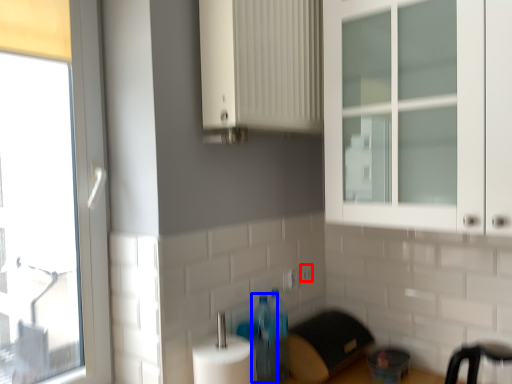
Question: Which object appears closest to the camera in this image, electric outlet (highlighted by a red box) or bottle (highlighted by a blue box)?

Choices:
 (A) electric outlet
 (B) bottle

Answer: (B)